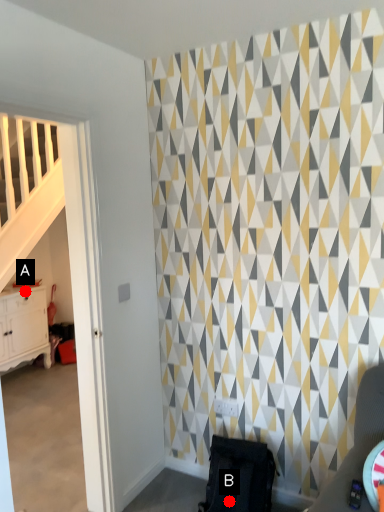
Question: Two points are circled on the image, labeled by A and B beside each circle. Which point is closer to the camera taking this photo?

Choices:
 (A) A is closer
 (B) B is closer

Answer: (B)